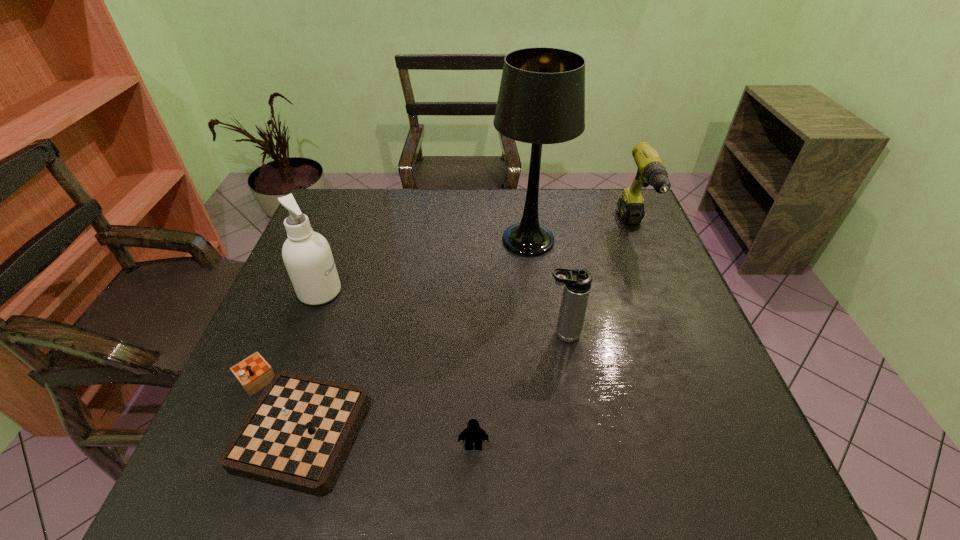
In the image, there is a desktop. Where is `free space at the far right corner`? This screenshot has width=960, height=540. free space at the far right corner is located at coordinates (619, 192).

Image resolution: width=960 pixels, height=540 pixels. Identify the location of vacant area at the near right corner of the desktop. (694, 470).

Locate an element on the screen. The width and height of the screenshot is (960, 540). free space that is in between the cleansing agent and the thermos bottle is located at coordinates (441, 313).

Find the location of a particular element. Image resolution: width=960 pixels, height=540 pixels. unoccupied area between the second shortest object and the cleansing agent is located at coordinates (396, 369).

You are a GUI agent. You are given a task and a screenshot of the screen. Output one action in this format:
    pyautogui.click(x=<x>, y=<y>)
    Task: Click on the free space that is in between the third tallest object and the chessboard
    The height and width of the screenshot is (540, 960).
    Given the screenshot: What is the action you would take?
    click(x=463, y=326)

Where is `vacant point located between the tallest object and the third shortest object`? This screenshot has height=540, width=960. vacant point located between the tallest object and the third shortest object is located at coordinates (545, 287).

The height and width of the screenshot is (540, 960). What are the coordinates of `vacant area that lies between the third object from left to right and the chessboard` in the screenshot? It's located at (382, 434).

The height and width of the screenshot is (540, 960). What are the coordinates of `free space that is in between the third farthest object and the fourth farthest object` in the screenshot? It's located at [441, 313].

Locate an element on the screen. vacant area that lies between the fifth tallest object and the drill is located at coordinates (554, 338).

Locate an element on the screen. unoccupied position between the shortest object and the fourth farthest object is located at coordinates (426, 378).